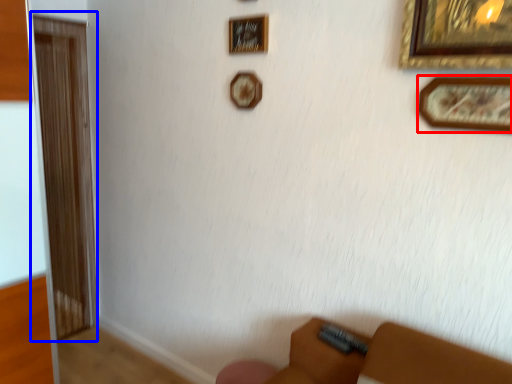
Question: Among these objects, which one is nearest to the camera, picture frame (highlighted by a red box) or screen door (highlighted by a blue box)?

Choices:
 (A) picture frame
 (B) screen door

Answer: (A)